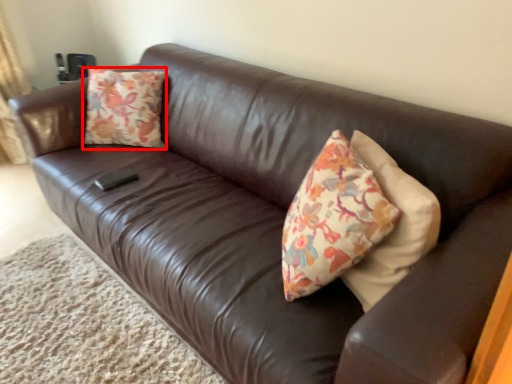
Question: From the image's perspective, what is the correct spatial positioning of throw pillow (annotated by the red box) in reference to plain?

Choices:
 (A) below
 (B) above

Answer: (B)